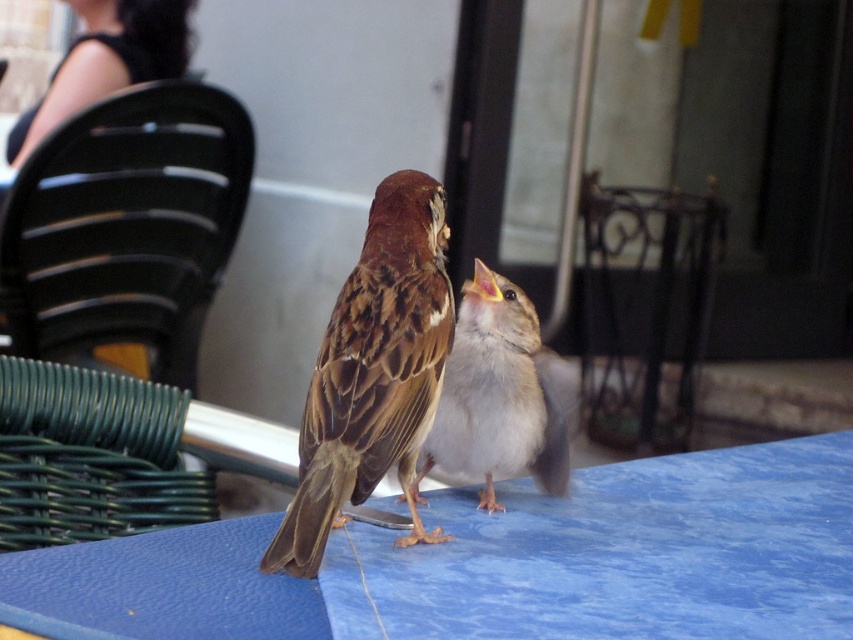
Question: Considering the relative positions of iron-forged chair at center and brown speckled feathers at center in the image provided, where is iron-forged chair at center located with respect to brown speckled feathers at center?

Choices:
 (A) above
 (B) below

Answer: (A)

Question: Which point appears farthest from the camera in this image?

Choices:
 (A) click(231, 188)
 (B) click(409, 408)

Answer: (A)

Question: Among these points, which one is farthest from the camera?

Choices:
 (A) (817, 540)
 (B) (135, 195)

Answer: (B)

Question: Is black plastic chair at upper left smaller than iron-forged chair at center?

Choices:
 (A) no
 (B) yes

Answer: (A)

Question: Is iron-forged chair at center above brown speckled feathers at center?

Choices:
 (A) no
 (B) yes

Answer: (B)

Question: Which point is farther from the camera taking this photo?

Choices:
 (A) (567, 387)
 (B) (486, 625)
 (C) (666, 230)
 (D) (352, 483)

Answer: (C)